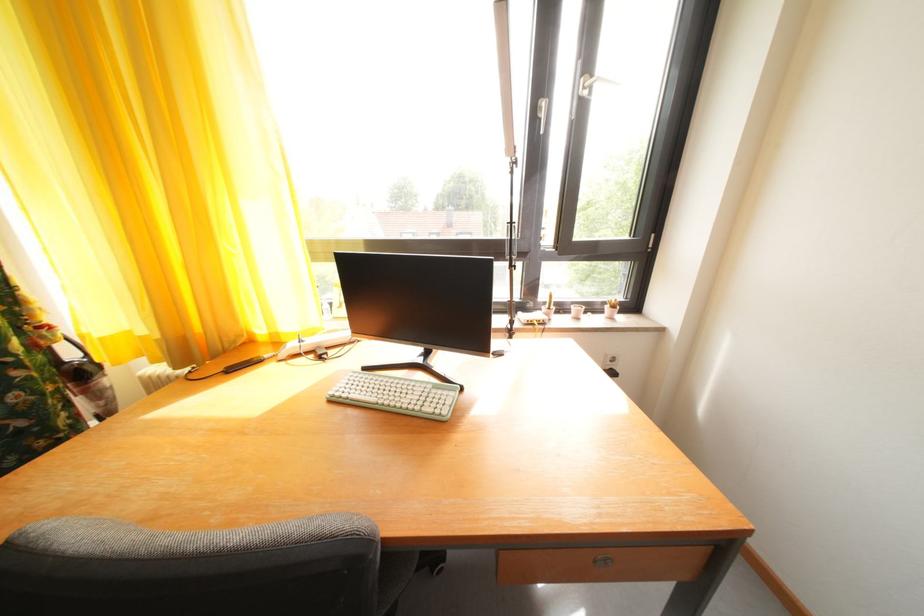
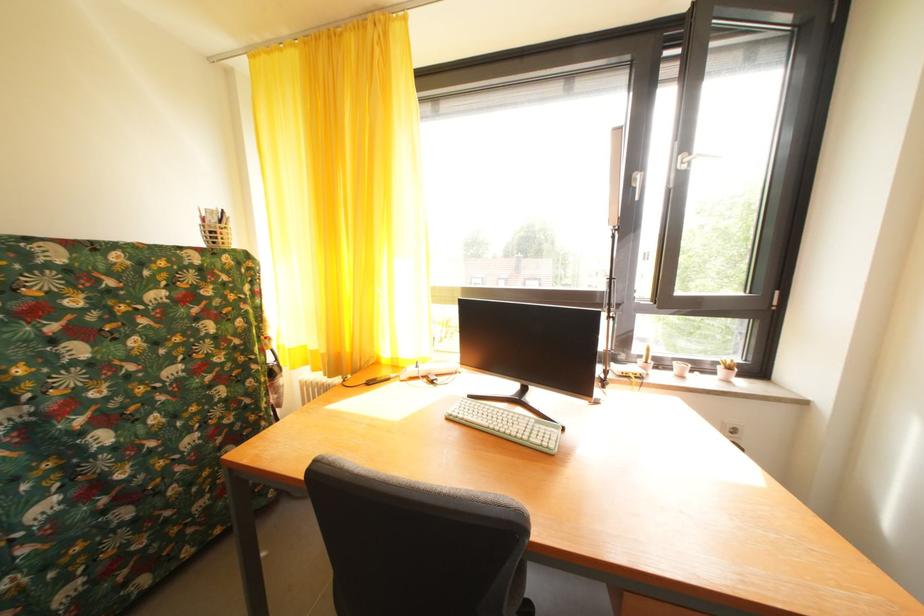
Where in the second image is the point corresponding to (x=581, y=313) from the first image?

(685, 370)